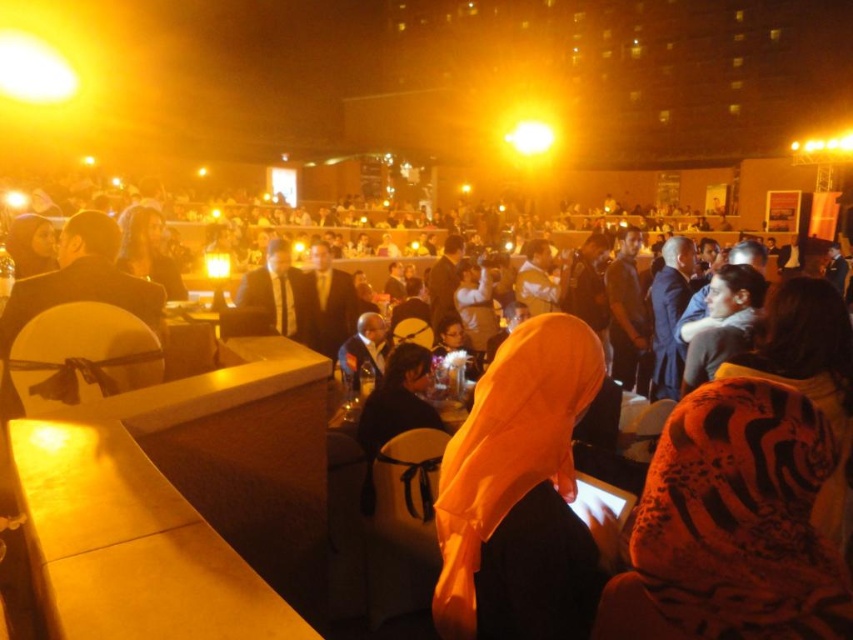
Can you confirm if orange fabric headscarf at center is thinner than wooden table at lower left?

Yes.

Which is below, orange fabric headscarf at center or wooden table at lower left?

Positioned lower is wooden table at lower left.

Find the location of `orange fabric headscarf at center`. orange fabric headscarf at center is located at coordinates (519, 493).

Based on the photo, between wooden table at lower left and matte black suit at center, which one has less height?

Standing shorter between the two is wooden table at lower left.

I want to click on wooden table at lower left, so click(131, 545).

Where is `wooden table at lower left`? wooden table at lower left is located at coordinates (131, 545).

Who is higher up, orange fabric headscarf at center or matte black suit at center?

matte black suit at center is higher up.

Can you confirm if orange fabric headscarf at center is bigger than matte black suit at center?

Incorrect, orange fabric headscarf at center is not larger than matte black suit at center.

Measure the distance between orange fabric headscarf at center and camera.

The distance of orange fabric headscarf at center from camera is 1.82 meters.

You are a GUI agent. You are given a task and a screenshot of the screen. Output one action in this format:
    pyautogui.click(x=<x>, y=<y>)
    Task: Click on the orange fabric headscarf at center
    The height and width of the screenshot is (640, 853).
    Given the screenshot: What is the action you would take?
    pyautogui.click(x=519, y=493)